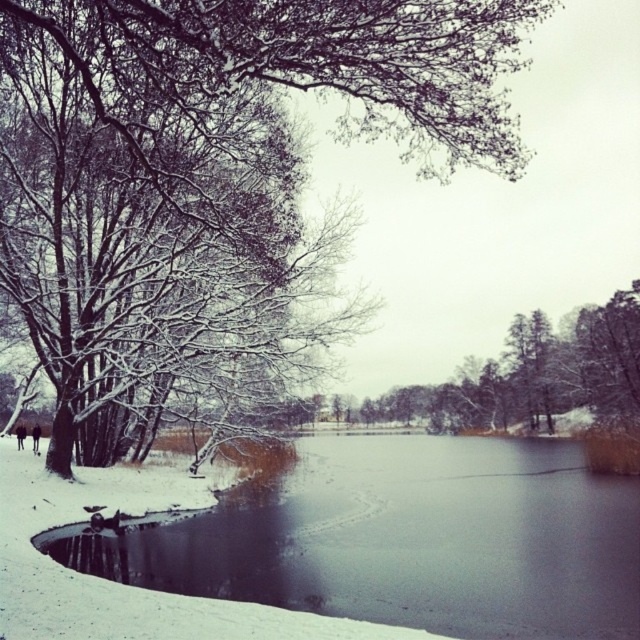
You are an artist planning to paint the winter scene. You want to ensure the green matte tree at center and dark brown leather boots at lower left are proportionally accurate. Which object should you draw wider in your painting?

The green matte tree at center should be drawn wider in the painting since its width is larger than the dark brown leather boots at lower left according to the description.

You are a hiker who needs to cross the smooth ice lake at lower left while carrying a dark brown fur coat at lower left. The ice can support a maximum weight of 60 pounds. Your total weight with the coat is 180 pounds. Can you safely cross the ice lake?

The ice lake can support a maximum of 60 pounds, but your total weight with the coat is 180 pounds, which exceeds the safe limit. Therefore, crossing the ice lake is not advisable.

You are an outdoor photographer planning to take a photo of the green matte tree at center and the dark brown leather boots at lower left. Based on the scene, which object should you focus on first if you want to ensure both are in sharp focus?

The green matte tree at center is taller than the dark brown leather boots at lower left, so you should focus on the green matte tree at center first to ensure both are in sharp focus.